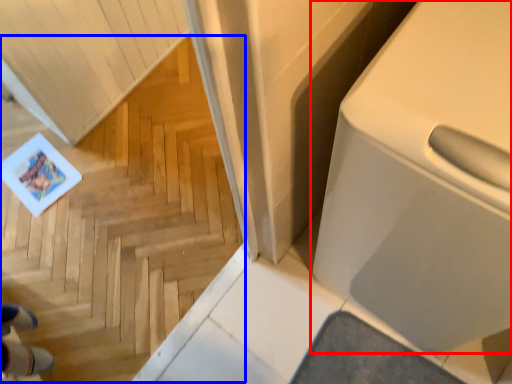
Question: Which object is closer to the camera taking this photo, home appliance (highlighted by a red box) or stairwell (highlighted by a blue box)?

Choices:
 (A) home appliance
 (B) stairwell

Answer: (B)